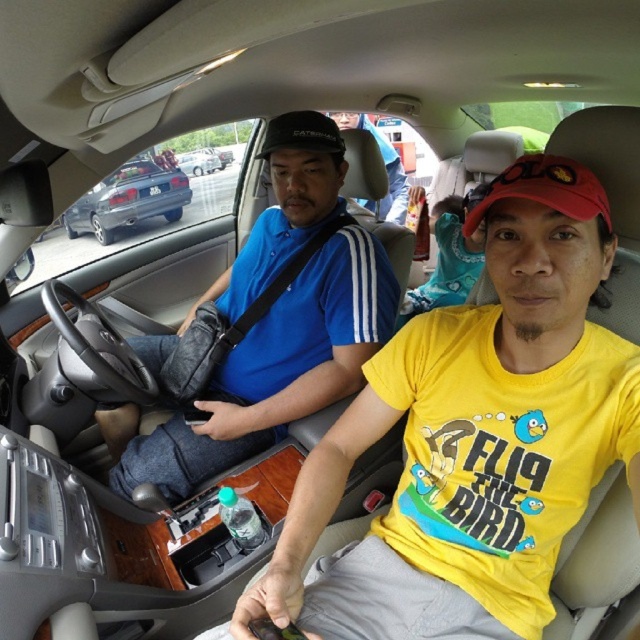
What is the exact coordinate of the blue fabric shirt at center in the image?

The blue fabric shirt at center is located at point [269,372].

You are a delivery robot that needs to place a package on the car seat. The package requires a flat surface at least 36 inches away from the camera to avoid the driver. Can you place the package at point (408, 621)?

The distance of point (408, 621) from the camera is 34.22 inches, which is less than the required 36 inches. Therefore, the package cannot be placed there as it is too close to the driver.